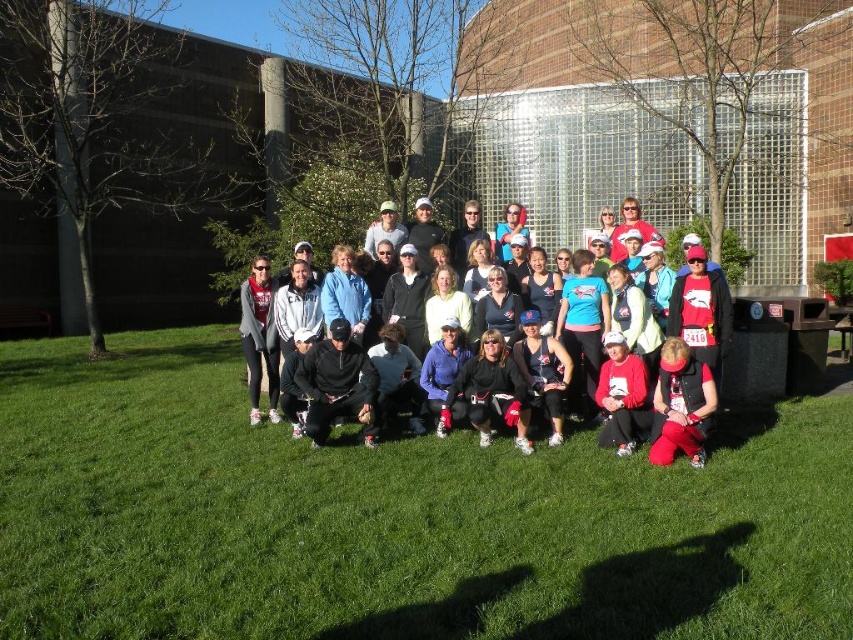
Who is higher up, black matte jacket at center or matte black vest at lower right?

black matte jacket at center is higher up.

Looking at this image, does black matte jacket at center appear under matte black vest at lower right?

Incorrect, black matte jacket at center is not positioned below matte black vest at lower right.

Where is `black matte jacket at center`? The width and height of the screenshot is (853, 640). black matte jacket at center is located at coordinates (338, 385).

At what (x,y) coordinates should I click in order to perform the action: click on black matte jacket at center. Please return your answer as a coordinate pair (x, y). Image resolution: width=853 pixels, height=640 pixels. Looking at the image, I should click on (338, 385).

Which is more to the left, green grass at center or solid white shirts at center?

From the viewer's perspective, green grass at center appears more on the left side.

Can you confirm if green grass at center is positioned above solid white shirts at center?

Incorrect, green grass at center is not positioned above solid white shirts at center.

Is point (457, 525) positioned behind point (492, 372)?

No.

Identify the location of green grass at center. (393, 518).

Is green grass at center wider than black matte jacket at center?

Indeed, green grass at center has a greater width compared to black matte jacket at center.

Between point (374, 524) and point (341, 376), which one is positioned behind?

The point (341, 376) is behind.

Identify the location of green grass at center. (393, 518).